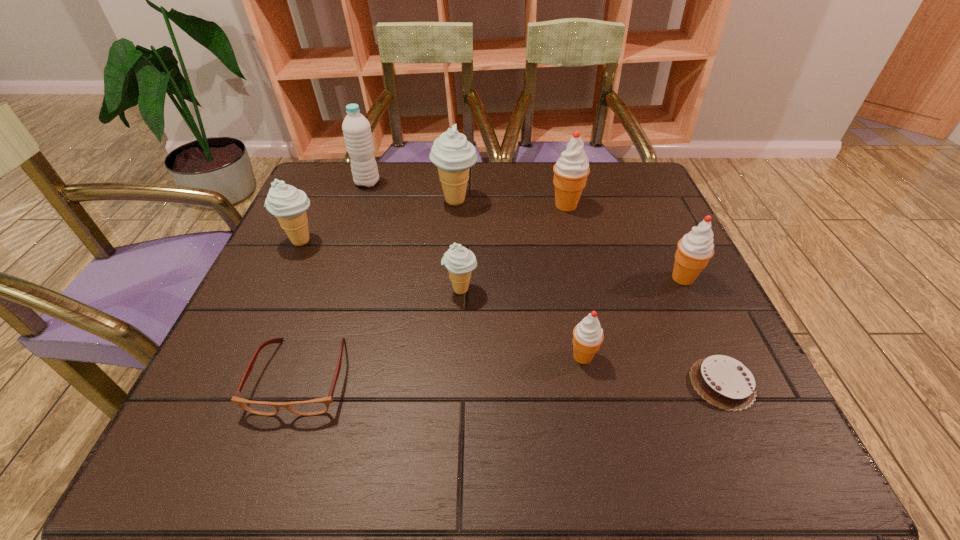
Locate an element on the screen. the closest red icecream to the farthest red icecream is located at coordinates (694, 250).

The image size is (960, 540). I want to click on beige icecream that stands as the second closest to the biggest beige icecream, so click(288, 204).

Where is `beige icecream identified as the second closest to the nearest red icecream`? beige icecream identified as the second closest to the nearest red icecream is located at coordinates (451, 152).

Find the location of a particular element. The width and height of the screenshot is (960, 540). free space that satisfies the following two spatial constraints: 1. on the back side of the rightmost red icecream; 2. on the left side of the nearest beige icecream is located at coordinates (461, 278).

Find the location of a particular element. This screenshot has width=960, height=540. blank area in the image that satisfies the following two spatial constraints: 1. on the front side of the chocolate cake; 2. on the right side of the fourth nearest icecream is located at coordinates (235, 383).

Find the location of `free space in the image that satisfies the following two spatial constraints: 1. on the front side of the biggest red icecream; 2. on the left side of the biggest beige icecream`. free space in the image that satisfies the following two spatial constraints: 1. on the front side of the biggest red icecream; 2. on the left side of the biggest beige icecream is located at coordinates (455, 205).